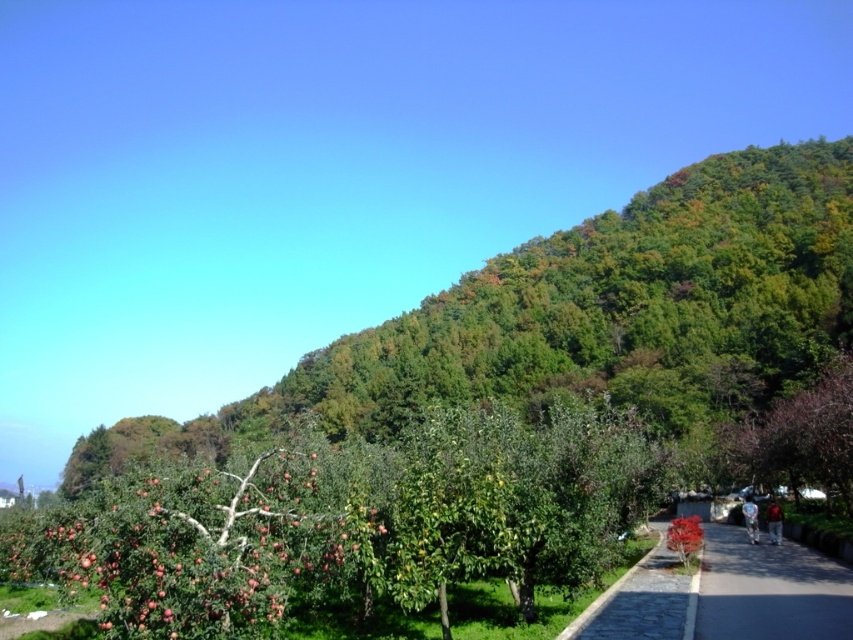
Question: Does ripe red apples at lower left appear on the right side of dark gray asphalt at lower right?

Choices:
 (A) no
 (B) yes

Answer: (A)

Question: Among these points, which one is nearest to the camera?

Choices:
 (A) (663, 545)
 (B) (381, 472)
 (C) (770, 548)

Answer: (B)

Question: Which of these objects is positioned farthest from the ripe red apples at lower left?

Choices:
 (A) smooth stone path at center
 (B) dark gray asphalt at lower right

Answer: (B)

Question: Which object appears closest to the camera in this image?

Choices:
 (A) ripe red apples at lower left
 (B) dark gray asphalt at lower right
 (C) smooth stone path at center

Answer: (A)

Question: Can you confirm if ripe red apples at lower left is positioned to the right of dark gray asphalt at lower right?

Choices:
 (A) no
 (B) yes

Answer: (A)

Question: Is ripe red apples at lower left above dark gray asphalt at lower right?

Choices:
 (A) yes
 (B) no

Answer: (A)